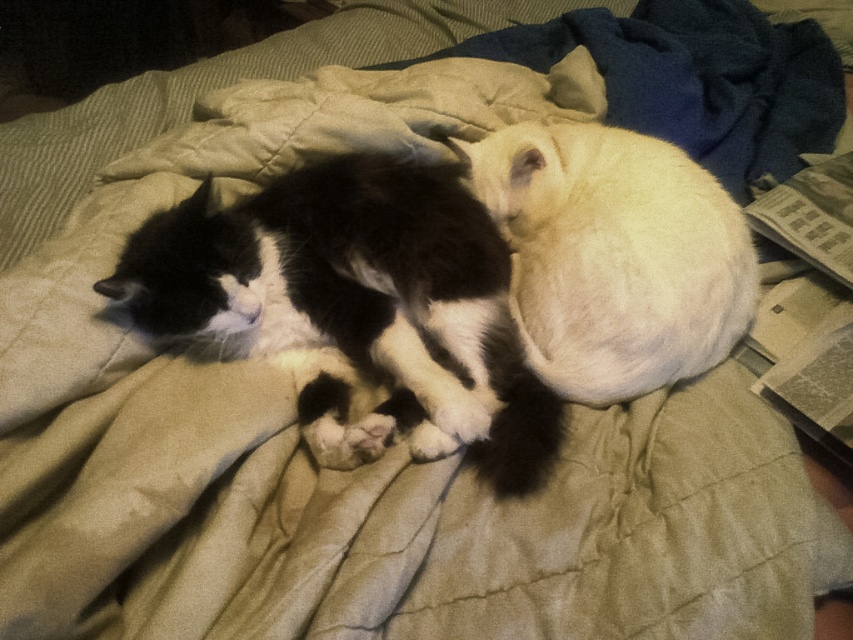
Can you confirm if black and white fur cat at center is wider than white fluffy cat at center?

Yes.

Who is positioned more to the left, black and white fur cat at center or white fluffy cat at center?

From the viewer's perspective, black and white fur cat at center appears more on the left side.

Does point (288, 180) lie behind point (561, 352)?

That is True.

You are a GUI agent. You are given a task and a screenshot of the screen. Output one action in this format:
    pyautogui.click(x=<x>, y=<y>)
    Task: Click on the black and white fur cat at center
    This screenshot has width=853, height=640.
    Given the screenshot: What is the action you would take?
    tap(357, 307)